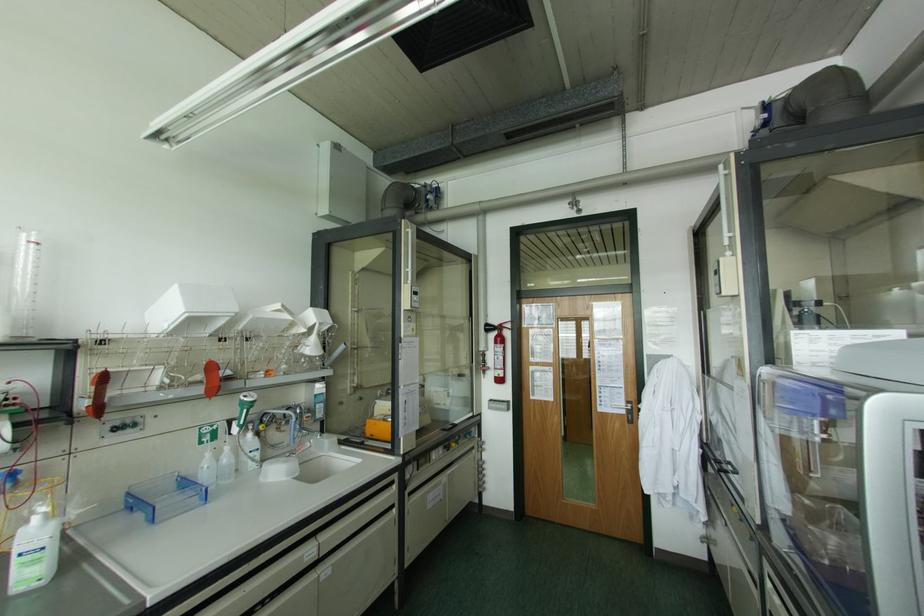
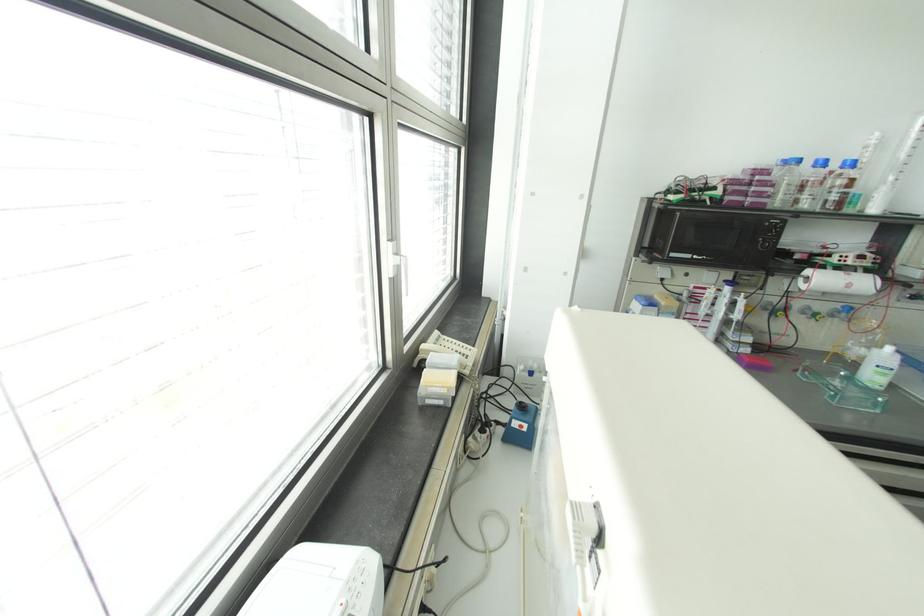
Where in the second image is the point corresponding to the point at 53,523 from the first image?

(898, 355)